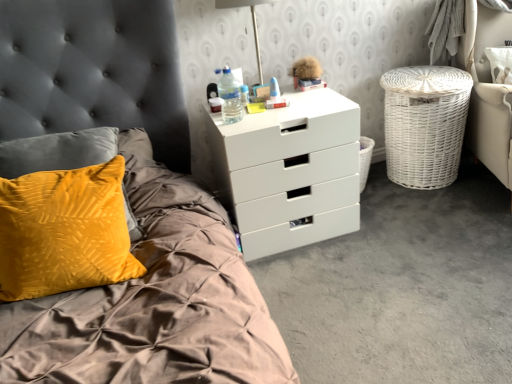
This screenshot has width=512, height=384. Identify the location of vacant region to the left of white wicker armchair at right. (414, 222).